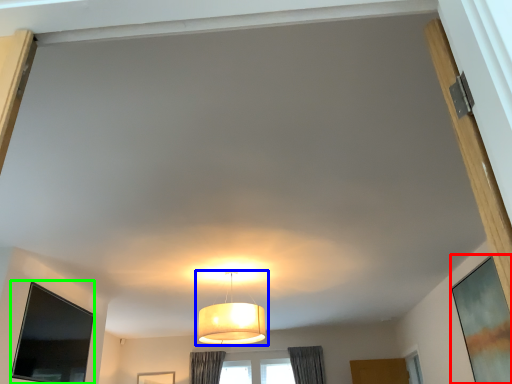
Question: Which object is positioned farthest from window screen (highlighted by a red box)? Select from lamp (highlighted by a blue box) and window screen (highlighted by a green box).

Choices:
 (A) lamp
 (B) window screen

Answer: (B)